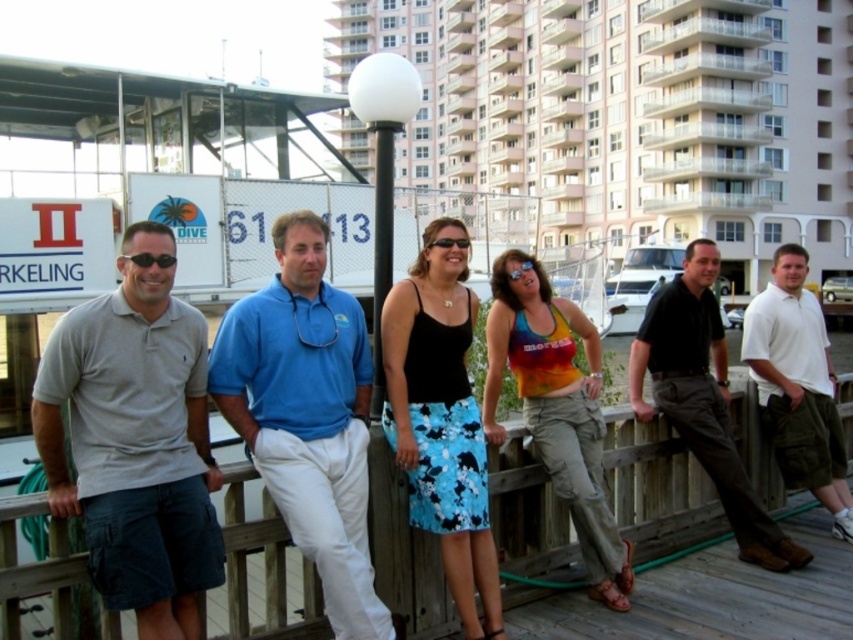
Question: Does black satin tank top at center have a smaller size compared to white cotton polo shirt at right?

Choices:
 (A) yes
 (B) no

Answer: (A)

Question: Is dark brown leather pants at right wider than white cotton polo shirt at right?

Choices:
 (A) yes
 (B) no

Answer: (A)

Question: Which point is closer to the camera?

Choices:
 (A) blue cotton polo shirt at center
 (B) white cotton polo shirt at right
 (C) light gray cotton polo shirt at left
 (D) wooden at left

Answer: (C)

Question: Estimate the real-world distances between objects in this image. Which object is closer to the dark brown leather pants at right?

Choices:
 (A) blue cotton polo shirt at center
 (B) light gray cotton polo shirt at left
 (C) white cotton polo shirt at right
 (D) wooden at left

Answer: (C)

Question: Is black satin tank top at center smaller than dark brown leather pants at right?

Choices:
 (A) no
 (B) yes

Answer: (B)

Question: Which object appears farthest from the camera in this image?

Choices:
 (A) wooden at left
 (B) dark brown leather pants at right
 (C) blue cotton polo shirt at center
 (D) light gray cotton polo shirt at left

Answer: (B)